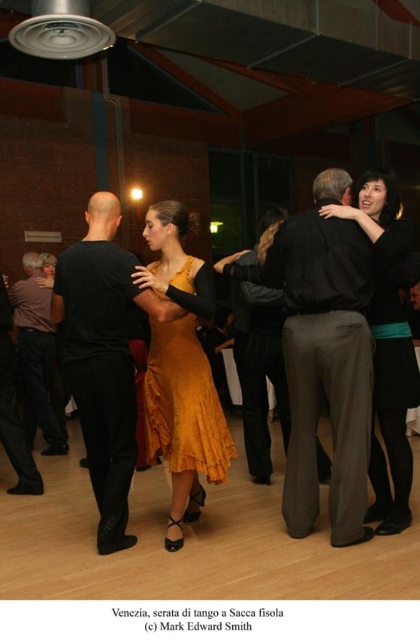
Question: Which object is the closest to the brown leather jacket at left?

Choices:
 (A) dark gray trousers at center
 (B) matte black dress at right
 (C) black matte shirt at center
 (D) black smooth shirt at left

Answer: (D)

Question: Is matte gold dress at center further to the viewer compared to velvet gold dress at center?

Choices:
 (A) no
 (B) yes

Answer: (A)

Question: Is matte gold dress at center smaller than matte black dress at right?

Choices:
 (A) yes
 (B) no

Answer: (B)

Question: Is dark gray trousers at center above matte black dress at right?

Choices:
 (A) no
 (B) yes

Answer: (A)

Question: Considering the real-world distances, which object is farthest from the dark gray trousers at center?

Choices:
 (A) black matte shirt at center
 (B) matte black dress at right
 (C) matte gold dress at center

Answer: (A)

Question: Which point is farther to the camera?

Choices:
 (A) (63, 451)
 (B) (12, 314)

Answer: (A)